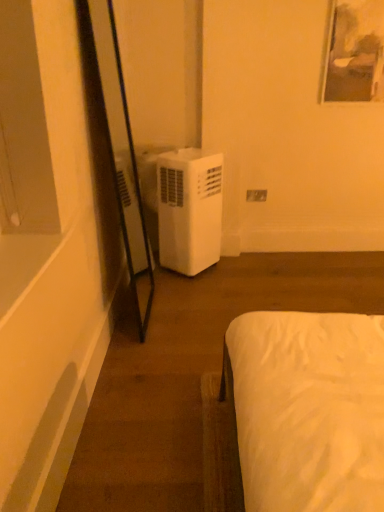
Question: Could you tell me if white plastic electric outlet at center is turned towards white plastic air conditioner at left?

Choices:
 (A) no
 (B) yes

Answer: (A)

Question: Does white plastic electric outlet at center have a lesser height compared to white plastic air conditioner at left?

Choices:
 (A) yes
 (B) no

Answer: (A)

Question: From the image's perspective, would you say white plastic electric outlet at center is shown under white plastic air conditioner at left?

Choices:
 (A) no
 (B) yes

Answer: (A)

Question: Can you confirm if white plastic electric outlet at center is thinner than white plastic air conditioner at left?

Choices:
 (A) yes
 (B) no

Answer: (A)

Question: Is white plastic electric outlet at center wider than white plastic air conditioner at left?

Choices:
 (A) no
 (B) yes

Answer: (A)

Question: Considering the relative positions of white plastic electric outlet at center and white plastic air conditioner at left in the image provided, is white plastic electric outlet at center to the right of white plastic air conditioner at left from the viewer's perspective?

Choices:
 (A) no
 (B) yes

Answer: (B)

Question: From a real-world perspective, is white plastic air conditioner at left on white plastic electric outlet at center?

Choices:
 (A) yes
 (B) no

Answer: (B)

Question: Is white plastic air conditioner at left in contact with white plastic electric outlet at center?

Choices:
 (A) yes
 (B) no

Answer: (B)

Question: Is white plastic air conditioner at left closer to the viewer compared to white plastic electric outlet at center?

Choices:
 (A) yes
 (B) no

Answer: (A)

Question: Can you confirm if white plastic air conditioner at left is bigger than white plastic electric outlet at center?

Choices:
 (A) no
 (B) yes

Answer: (B)

Question: Is white plastic air conditioner at left positioned with its back to white plastic electric outlet at center?

Choices:
 (A) yes
 (B) no

Answer: (B)

Question: Can you confirm if white plastic air conditioner at left is wider than white plastic electric outlet at center?

Choices:
 (A) no
 (B) yes

Answer: (B)

Question: Would you say white plastic electric outlet at center is to the left or to the right of white plastic air conditioner at left in the picture?

Choices:
 (A) left
 (B) right

Answer: (B)